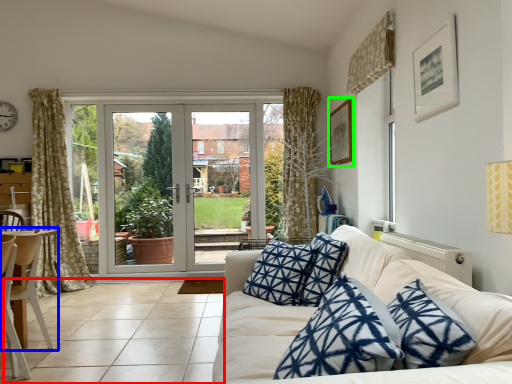
Question: Estimate the real-world distances between objects in this image. Which object is closer to tile (highlighted by a red box), chair (highlighted by a blue box) or picture frame (highlighted by a green box)?

Choices:
 (A) chair
 (B) picture frame

Answer: (A)